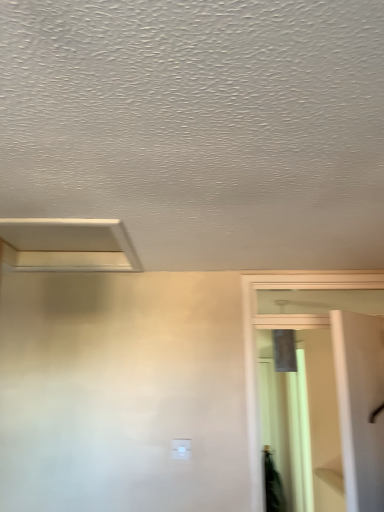
Describe the element at coordinates (68, 245) in the screenshot. I see `white matte exhaust hood at upper left` at that location.

What is the approximate height of clear glass screen door at right?

The height of clear glass screen door at right is 1.07 meters.

Find the location of a particular element. white plastic light switch at center is located at coordinates (181, 449).

You are a GUI agent. You are given a task and a screenshot of the screen. Output one action in this format:
    pyautogui.click(x=<x>, y=<y>)
    Task: Click on the white matte exhaust hood at upper left
    Image resolution: width=384 pixels, height=512 pixels.
    Given the screenshot: What is the action you would take?
    pyautogui.click(x=68, y=245)

Is white plastic light switch at center wider than white matte exhaust hood at upper left?

In fact, white plastic light switch at center might be narrower than white matte exhaust hood at upper left.

What's the angular difference between white plastic light switch at center and white matte exhaust hood at upper left's facing directions?

There is a 2.09-degree angle between the facing directions of white plastic light switch at center and white matte exhaust hood at upper left.

Considering the points (178, 457) and (136, 255), which point is in front, point (178, 457) or point (136, 255)?

The point (136, 255) is in front.

Between white plastic light switch at center and white matte exhaust hood at upper left, which one has less height?

white matte exhaust hood at upper left is shorter.

What's the angular difference between white matte exhaust hood at upper left and white plastic light switch at center's facing directions?

There is a 2.09-degree angle between the facing directions of white matte exhaust hood at upper left and white plastic light switch at center.

Are white matte exhaust hood at upper left and white plastic light switch at center making contact?

No, white matte exhaust hood at upper left is not beside white plastic light switch at center.

Is white matte exhaust hood at upper left inside or outside of white plastic light switch at center?

white matte exhaust hood at upper left cannot be found inside white plastic light switch at center.

From the picture: Is white matte exhaust hood at upper left at the right side of white plastic light switch at center?

Incorrect, white matte exhaust hood at upper left is not on the right side of white plastic light switch at center.

Is white matte exhaust hood at upper left beside clear glass screen door at right?

There is a gap between white matte exhaust hood at upper left and clear glass screen door at right.

From the image's perspective, does white matte exhaust hood at upper left appear lower than clear glass screen door at right?

Incorrect, from the image's perspective, white matte exhaust hood at upper left is higher than clear glass screen door at right.

Between white matte exhaust hood at upper left and clear glass screen door at right, which one is positioned behind?

clear glass screen door at right is further away from the camera.

This screenshot has width=384, height=512. I want to click on screen door below the white matte exhaust hood at upper left (from the image's perspective), so click(284, 327).

In the scene shown: Which object is positioned more to the right, clear glass screen door at right or white matte exhaust hood at upper left?

clear glass screen door at right.

Which is closer to the camera, (255,383) or (119,253)?

Positioned in front is point (119,253).

From their relative heights in the image, would you say white plastic light switch at center is taller or shorter than clear glass screen door at right?

white plastic light switch at center is shorter than clear glass screen door at right.

Considering their positions, is white plastic light switch at center located in front of or behind clear glass screen door at right?

white plastic light switch at center is behind clear glass screen door at right.

Is white plastic light switch at center touching clear glass screen door at right?

white plastic light switch at center is not next to clear glass screen door at right, and they're not touching.

From the image's perspective, which is above, white plastic light switch at center or clear glass screen door at right?

clear glass screen door at right is shown above in the image.

Is white plastic light switch at center completely or partially inside clear glass screen door at right?

Definitely not — white plastic light switch at center is not inside clear glass screen door at right.

Considering the points (305, 275) and (183, 451), which point is behind, point (305, 275) or point (183, 451)?

Positioned behind is point (305, 275).

Find the location of `screen door in front of the white plastic light switch at center`. screen door in front of the white plastic light switch at center is located at coordinates (x=284, y=327).

From the image's perspective, relative to white plastic light switch at center, is clear glass screen door at right above or below?

clear glass screen door at right is above white plastic light switch at center.

Where is `light switch on the right of the white matte exhaust hood at upper left`? The height and width of the screenshot is (512, 384). light switch on the right of the white matte exhaust hood at upper left is located at coordinates (181, 449).

Where is `light switch that appears behind the white matte exhaust hood at upper left`? Image resolution: width=384 pixels, height=512 pixels. light switch that appears behind the white matte exhaust hood at upper left is located at coordinates (181, 449).

Consider the image. When comparing their distances from white matte exhaust hood at upper left, does white plastic light switch at center or clear glass screen door at right seem closer?

clear glass screen door at right.

From the image, which object appears to be nearer to white plastic light switch at center, white matte exhaust hood at upper left or clear glass screen door at right?

clear glass screen door at right is positioned closer to the anchor white plastic light switch at center.

Which object lies further to the anchor point white plastic light switch at center, clear glass screen door at right or white matte exhaust hood at upper left?

The object further to white plastic light switch at center is white matte exhaust hood at upper left.

Based on their spatial positions, is clear glass screen door at right or white plastic light switch at center closer to white matte exhaust hood at upper left?

The object closer to white matte exhaust hood at upper left is clear glass screen door at right.

Based on their spatial positions, is white plastic light switch at center or white matte exhaust hood at upper left further from clear glass screen door at right?

white matte exhaust hood at upper left lies further to clear glass screen door at right than the other object.

Looking at the image, which one is located further to clear glass screen door at right, white matte exhaust hood at upper left or white plastic light switch at center?

Based on the image, white matte exhaust hood at upper left appears to be further to clear glass screen door at right.

The height and width of the screenshot is (512, 384). What are the coordinates of `light switch between white matte exhaust hood at upper left and clear glass screen door at right in the horizontal direction` in the screenshot? It's located at (181, 449).